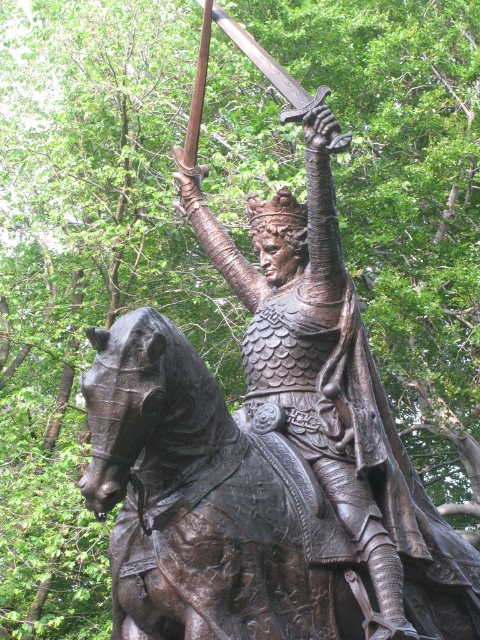
Question: Which object is positioned closest to the polished bronze sword at upper center?

Choices:
 (A) bronze armor at center
 (B) bronze textured horse at center

Answer: (A)

Question: Which of the following is the closest to the observer?

Choices:
 (A) bronze textured horse at center
 (B) bronze armor at center
 (C) polished bronze sword at upper center

Answer: (A)

Question: Can you confirm if bronze armor at center is wider than polished bronze sword at upper center?

Choices:
 (A) yes
 (B) no

Answer: (B)

Question: Is bronze armor at center thinner than polished bronze sword at upper center?

Choices:
 (A) no
 (B) yes

Answer: (B)

Question: Can you confirm if bronze armor at center is positioned to the left of polished bronze sword at upper center?

Choices:
 (A) no
 (B) yes

Answer: (A)

Question: Which of the following is the farthest from the observer?

Choices:
 (A) (179, 477)
 (B) (374, 458)

Answer: (B)